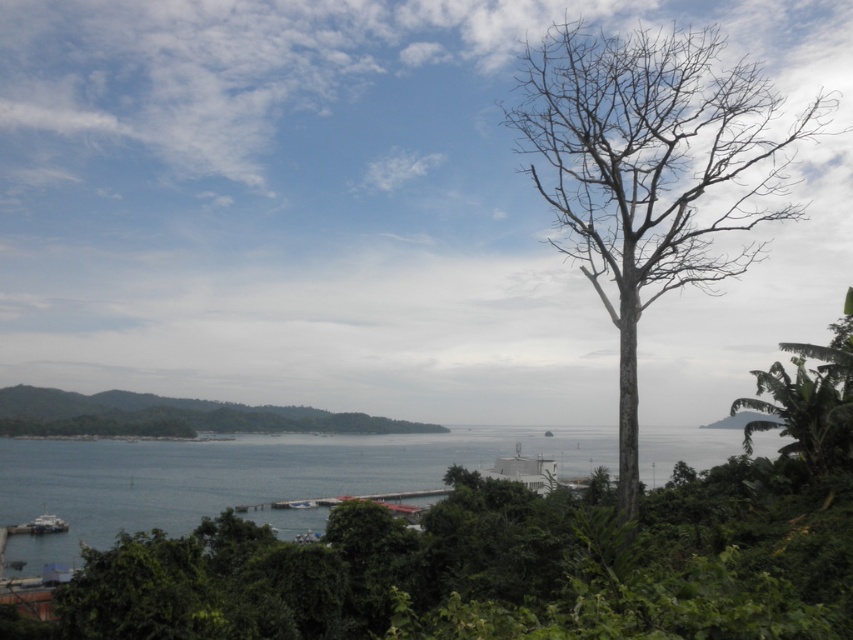
You are standing at the center of the image and see the bare wood tree at right and the green leafy tree at lower left. Which tree is positioned more to the east if the image is oriented with the pier pointing north?

The bare wood tree at right is positioned more to the east because it is to the right of the green leafy tree at lower left, and since the pier points north, right in the image corresponds to east.

You are standing at point [173,416] in the coastal landscape. What object is located at this point?

The green leafy tree at lower left is located at point [173,416].